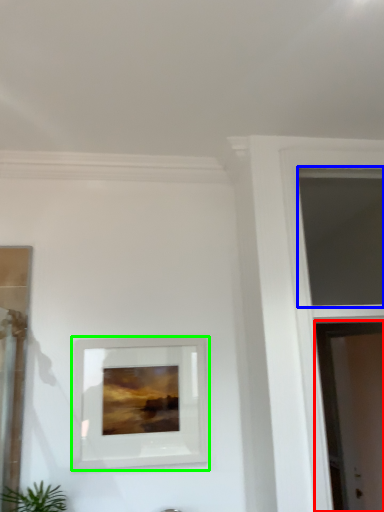
Question: Which object is the farthest from screen door (highlighted by a red box)? Choose among these: window (highlighted by a blue box) or picture frame (highlighted by a green box).

Choices:
 (A) window
 (B) picture frame

Answer: (B)